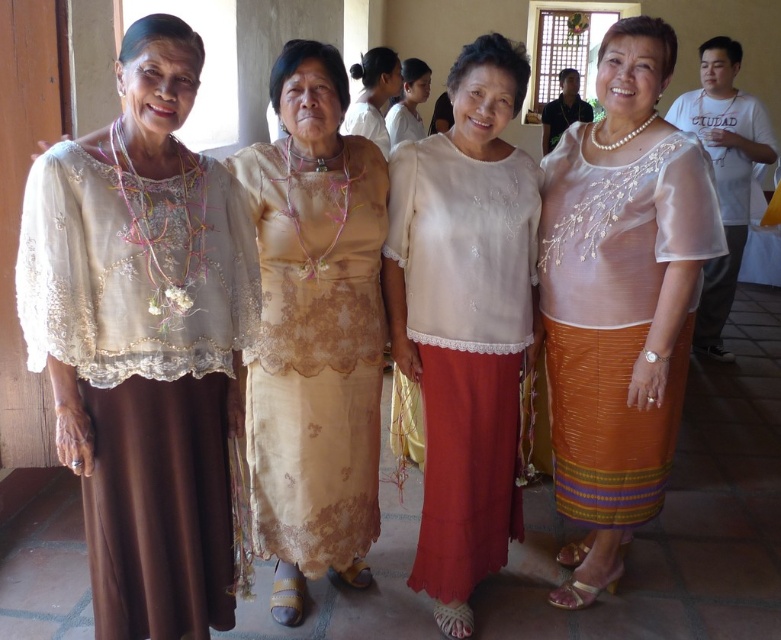
You are a photographer adjusting your camera settings to capture the light beige lace blouse at center and the pearl necklace at upper center. Which object should you focus on first to ensure both are in sharp focus?

You should focus on the light beige lace blouse at center first because it is closer to the viewer than the pearl necklace at upper center. By focusing on the closer object, the necklace will also be in focus due to the depth of field.

You are a fashion designer observing the group of women in the image. You need to determine which blouse, the light beige lace blouse at center or the white sheer blouse at upper center, would require more fabric to create a similar design. Based on their sizes, which one would need more material?

The light beige lace blouse at center is much taller than the white sheer blouse at upper center, so it would require more fabric to create a similar design.